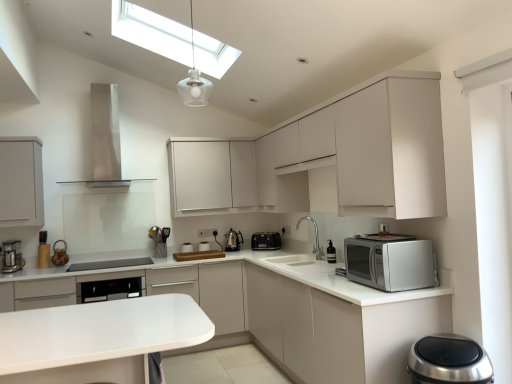
Question: From the image's perspective, is white matte toaster at center, the 4th appliance positioned from the front, under white glossy countertop at right, the first countertop viewed from the front?

Choices:
 (A) no
 (B) yes

Answer: (A)

Question: From a real-world perspective, is white matte toaster at center, which is the second appliance from back to front, beneath white glossy countertop at right, arranged as the second countertop when viewed from the back?

Choices:
 (A) yes
 (B) no

Answer: (B)

Question: Considering the relative sizes of white matte toaster at center, the third appliance from the right, and white glossy countertop at right, the first countertop viewed from the front, in the image provided, is white matte toaster at center, the third appliance from the right, thinner than white glossy countertop at right, the first countertop viewed from the front,?

Choices:
 (A) no
 (B) yes

Answer: (B)

Question: Is white matte toaster at center, which is the third appliance from left to right, outside white glossy countertop at right, the first countertop viewed from the front?

Choices:
 (A) yes
 (B) no

Answer: (B)

Question: Are white matte toaster at center, which is the third appliance from left to right, and white glossy countertop at right, the first countertop viewed from the front, making contact?

Choices:
 (A) yes
 (B) no

Answer: (B)

Question: Do you think white matte cabinet at right, arranged as the 4th cabinetry when viewed from the left, is within metallic silver utensil holder at center, which is the 2th appliance in left-to-right order, or outside of it?

Choices:
 (A) inside
 (B) outside

Answer: (B)

Question: Considering the positions of point (434, 324) and point (161, 246), is point (434, 324) closer or farther from the camera than point (161, 246)?

Choices:
 (A) farther
 (B) closer

Answer: (B)

Question: In terms of size, does white matte cabinet at right, positioned as the 1th cabinetry in right-to-left order, appear bigger or smaller than metallic silver utensil holder at center, the third appliance positioned from the back?

Choices:
 (A) big
 (B) small

Answer: (A)

Question: From the image's perspective, relative to metallic silver utensil holder at center, which is the 2th appliance in left-to-right order, is white matte cabinet at right, positioned as the 1th cabinetry in right-to-left order, above or below?

Choices:
 (A) below
 (B) above

Answer: (A)

Question: Choose the correct answer: Is transparent glass skylight at upper center inside metallic silver utensil holder at center, the third appliance positioned from the back, or outside it?

Choices:
 (A) inside
 (B) outside

Answer: (B)

Question: Considering the relative positions of transparent glass skylight at upper center and metallic silver utensil holder at center, the third appliance positioned from the back, in the image provided, is transparent glass skylight at upper center to the left or to the right of metallic silver utensil holder at center, the third appliance positioned from the back,?

Choices:
 (A) right
 (B) left

Answer: (A)

Question: Considering the positions of transparent glass skylight at upper center and metallic silver utensil holder at center, the 4th appliance in the right-to-left sequence, in the image, is transparent glass skylight at upper center bigger or smaller than metallic silver utensil holder at center, the 4th appliance in the right-to-left sequence,?

Choices:
 (A) small
 (B) big

Answer: (B)

Question: Is transparent glass skylight at upper center wider or thinner than metallic silver utensil holder at center, the third appliance positioned from the back?

Choices:
 (A) thin
 (B) wide

Answer: (B)

Question: From a real-world perspective, relative to white matte cabinet at right, positioned as the 1th cabinetry in right-to-left order, is stainless steel range hood at upper center, positioned as the 1th home appliance in left-to-right order, vertically above or below?

Choices:
 (A) below
 (B) above

Answer: (B)

Question: In the image, is stainless steel range hood at upper center, positioned as the 1th home appliance in left-to-right order, positioned in front of or behind white matte cabinet at right, arranged as the 4th cabinetry when viewed from the left?

Choices:
 (A) behind
 (B) front

Answer: (A)